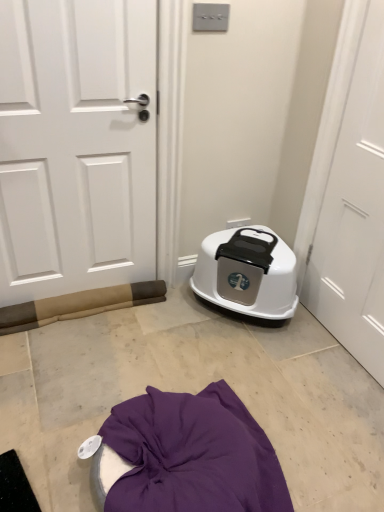
Question: In terms of size, does white matte door at left, acting as the second door starting from the right, appear bigger or smaller than white matte door at right, which is counted as the first door, starting from the right?

Choices:
 (A) big
 (B) small

Answer: (A)

Question: From the image's perspective, is white matte door at left, acting as the second door starting from the right, located above or below white matte door at right, arranged as the second door when viewed from the left?

Choices:
 (A) below
 (B) above

Answer: (B)

Question: Estimate the real-world distances between objects in this image. Which object is closer to the white matte door at right, which is counted as the first door, starting from the right?

Choices:
 (A) white matte door at left, acting as the second door starting from the right
 (B) white plastic litter box at center

Answer: (B)

Question: Estimate the real-world distances between objects in this image. Which object is farther from the white plastic litter box at center?

Choices:
 (A) white matte door at left, the first door positioned from the left
 (B) white matte door at right, which is counted as the first door, starting from the right

Answer: (A)